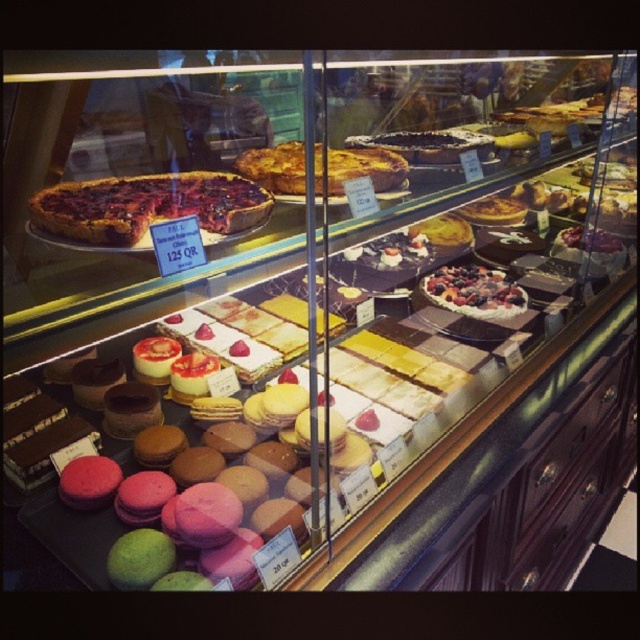
Question: Observing the image, what is the correct spatial positioning of dark chocolate pie at upper left in reference to berry-topped tart at center?

Choices:
 (A) left
 (B) right

Answer: (A)

Question: Which of the following is the closest to the observer?

Choices:
 (A) dark chocolate pie at upper left
 (B) golden flaky pie at center
 (C) berry-topped tart at center

Answer: (A)

Question: Can you confirm if golden flaky pie at center is positioned below berry-topped tart at center?

Choices:
 (A) no
 (B) yes

Answer: (A)

Question: Which point is closer to the camera taking this photo?

Choices:
 (A) (301, 170)
 (B) (452, 304)
 (C) (104, 179)

Answer: (C)

Question: Does dark chocolate pie at upper left appear under golden flaky pie at center?

Choices:
 (A) yes
 (B) no

Answer: (A)

Question: Considering the real-world distances, which object is farthest from the golden flaky pie at center?

Choices:
 (A) dark chocolate pie at upper left
 (B) berry-topped tart at center

Answer: (B)